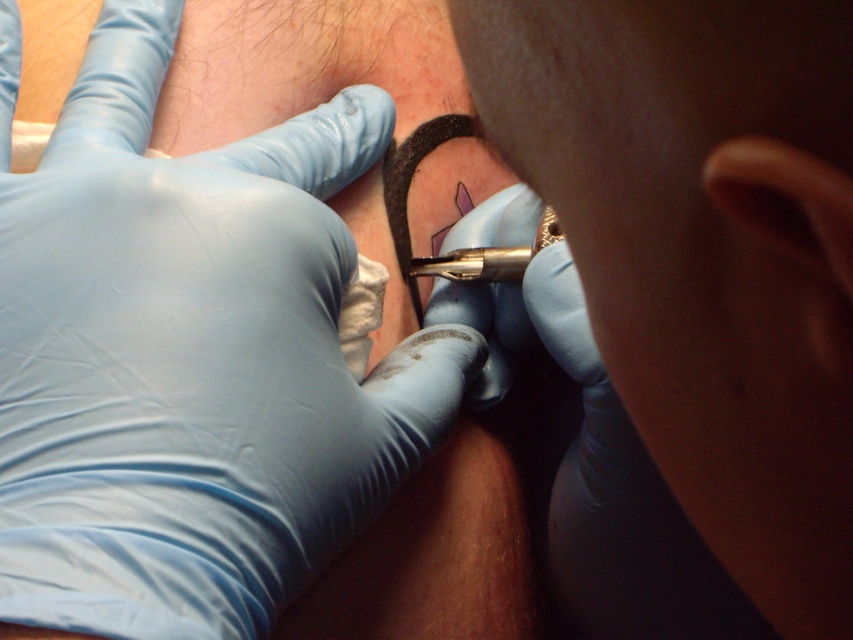
You are a photographer trying to capture the tattooing process. You notice two blue rubber gloves in the scene. Which glove, the blue rubber glove at upper left or the blue rubber glove at center, is closer to the camera?

The blue rubber glove at upper left is closer to the camera because it is in front of the blue rubber glove at center.